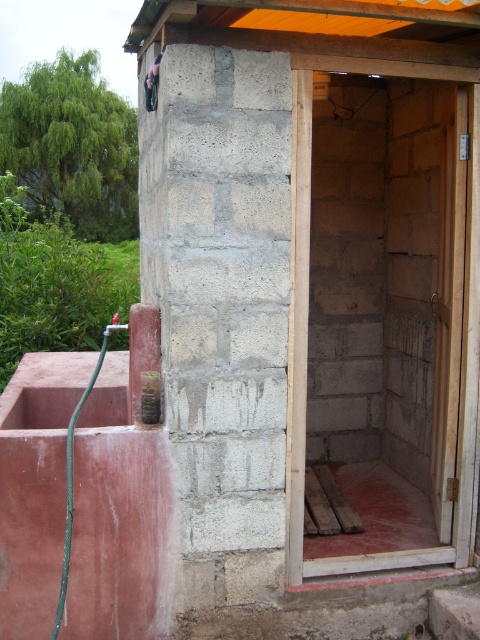
Is the position of gray concrete block at center more distant than that of green rubber hose at lower left?

No, gray concrete block at center is closer to the viewer.

Locate an element on the screen. Image resolution: width=480 pixels, height=640 pixels. gray concrete block at center is located at coordinates (313, 289).

Locate an element on the screen. This screenshot has width=480, height=640. gray concrete block at center is located at coordinates (313, 289).